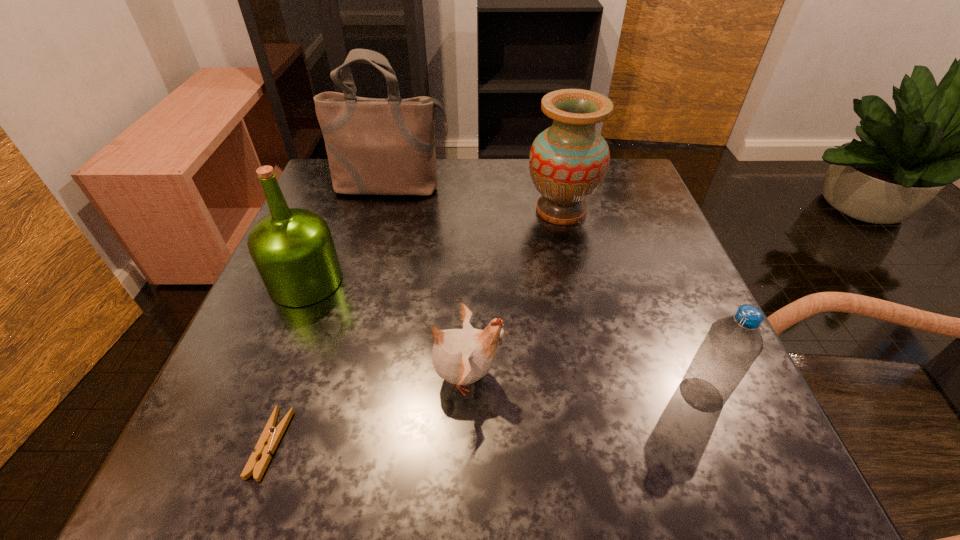
In the image, there is a desktop. Where is `vacant space at the near right corner`? The image size is (960, 540). vacant space at the near right corner is located at coordinates (685, 472).

At what (x,y) coordinates should I click in order to perform the action: click on free spot between the clothespin and the vase. Please return your answer as a coordinate pair (x, y). This screenshot has width=960, height=540. Looking at the image, I should click on (416, 327).

The height and width of the screenshot is (540, 960). Find the location of `empty space between the bird and the shortest object`. empty space between the bird and the shortest object is located at coordinates (369, 410).

Identify the location of free space between the rightmost object and the tallest object. This screenshot has height=540, width=960. coord(546,291).

The image size is (960, 540). In order to click on free space between the olive oil and the rightmost object in this screenshot , I will do `click(503, 338)`.

Locate an element on the screen. empty space between the water bottle and the fourth nearest object is located at coordinates (503, 338).

Where is `free space between the second shortest object and the tallest object`? free space between the second shortest object and the tallest object is located at coordinates (429, 282).

Find the location of a particular element. empty space between the shortest object and the third farthest object is located at coordinates (288, 363).

Identify the location of free space between the fourth nearest object and the shortest object. (288, 363).

Image resolution: width=960 pixels, height=540 pixels. Find the location of `vacant space in between the third farthest object and the second shortest object`. vacant space in between the third farthest object and the second shortest object is located at coordinates (386, 329).